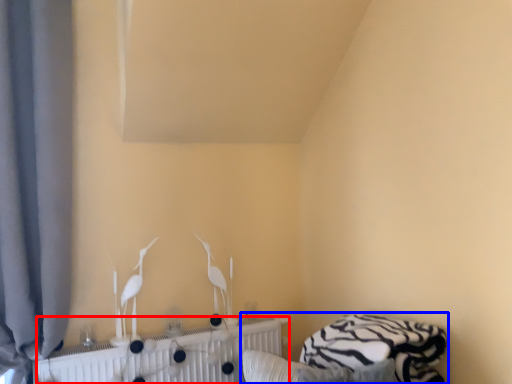
Question: Which object appears farthest to the camera in this image, radiator (highlighted by a red box) or bed (highlighted by a blue box)?

Choices:
 (A) radiator
 (B) bed

Answer: (A)